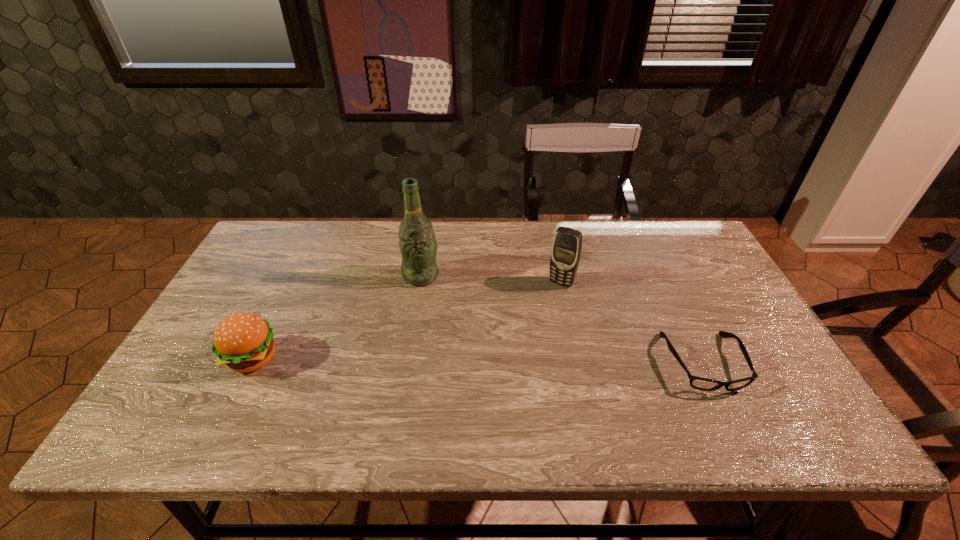
At what (x,y) coordinates should I click in order to perform the action: click on free region that satisfies the following two spatial constraints: 1. on the front side of the cellular telephone; 2. on the left side of the second object from left to right. Please return your answer as a coordinate pair (x, y). Looking at the image, I should click on (420, 283).